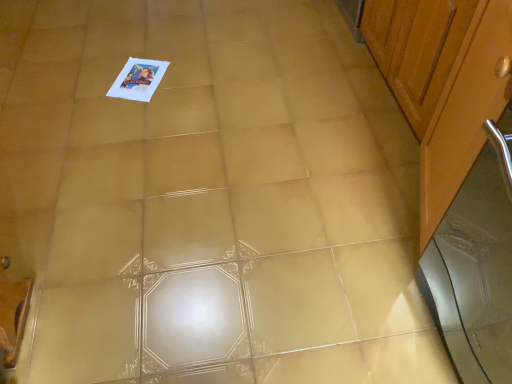
At what (x,y) coordinates should I click in order to perform the action: click on blank area beneath silver metallic screen door at right (from a real-world perspective). Please return your answer as a coordinate pair (x, y). Looking at the image, I should click on (452, 332).